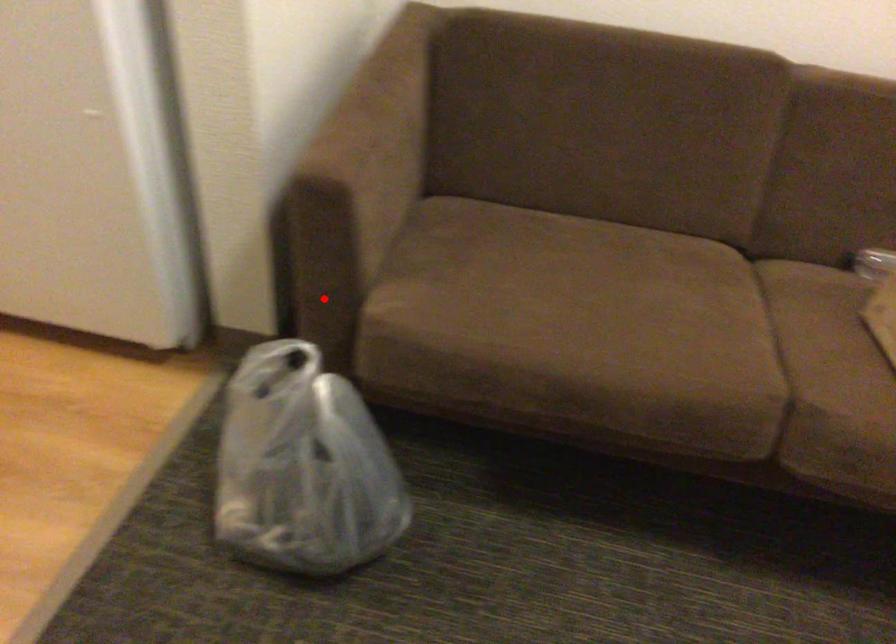
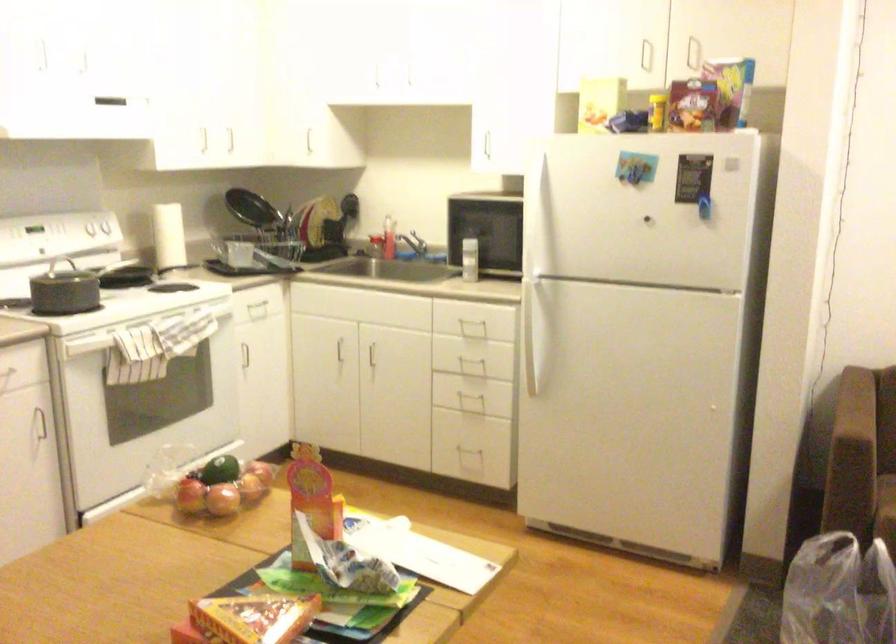
Question: I am providing you with two images of the same scene from different viewpoints. A red point is shown in image1. For the corresponding object point in image2, is it positioned nearer or farther from the camera?

Choices:
 (A) Nearer
 (B) Farther

Answer: (B)